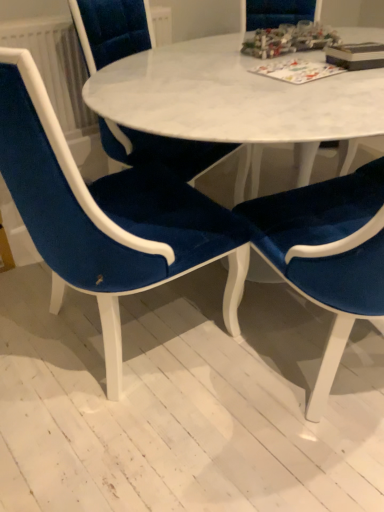
Find the location of a particular element. The height and width of the screenshot is (512, 384). free location to the right of velvet blue chair at lower left, the 3th chair in the right-to-left sequence is located at coordinates (244, 367).